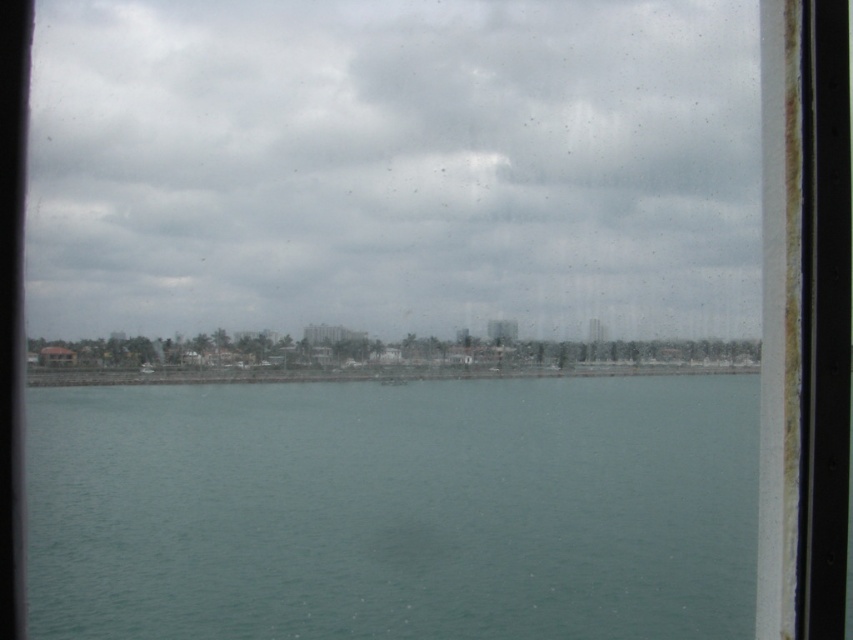
You are standing inside a ship cabin and looking through the window. You see the cloudy sky at upper center and the teal smooth water at center. Which of these two objects is positioned higher in the window frame?

The cloudy sky at upper center is positioned higher in the window frame than the teal smooth water at center because it is located above it according to the description.

You are an architect designing a new observation deck. You need to decide whether to install a large window facing the cloudy sky at upper center or the teal smooth water at center. Which option provides a wider view based on their sizes?

The cloudy sky at upper center is larger in size than the teal smooth water at center, so installing a window facing the cloudy sky at upper center would provide a wider view.

You are standing inside the ship and looking through the window. There are two points marked on the window at coordinates point (131,157) and point (672,545). Which point is closer to you?

Point (672,545) is closer to you because point (131,157) is behind it.